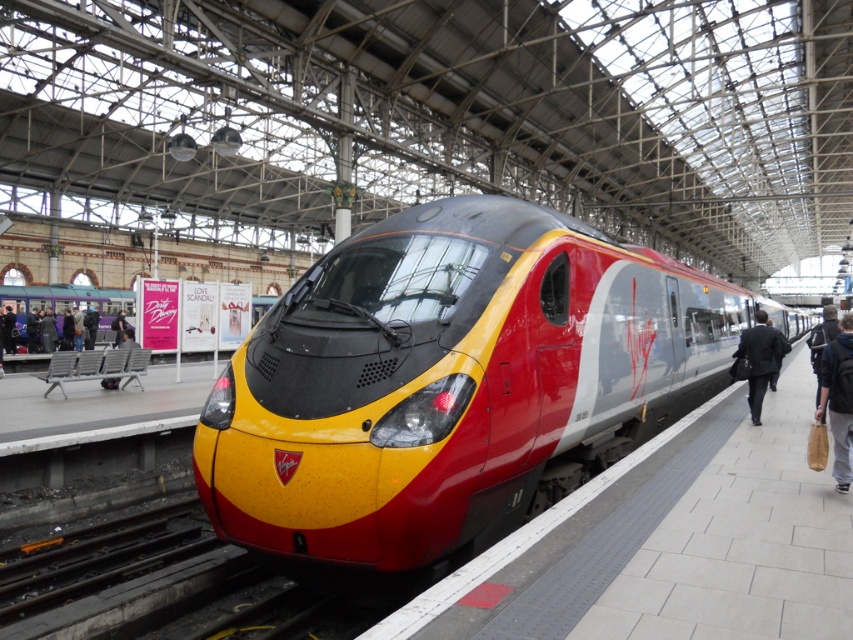
Does metallic red train at center have a larger size compared to dark purple clothing at left?

Indeed, metallic red train at center has a larger size compared to dark purple clothing at left.

Can you confirm if metallic red train at center is positioned below dark purple clothing at left?

Correct, metallic red train at center is located below dark purple clothing at left.

Does point (546, 452) come closer to viewer compared to point (55, 312)?

Yes.

Image resolution: width=853 pixels, height=640 pixels. I want to click on metallic red train at center, so click(450, 380).

Can you confirm if metallic red train at center is smaller than dark suit at right?

No, metallic red train at center is not smaller than dark suit at right.

This screenshot has width=853, height=640. What do you see at coordinates (450, 380) in the screenshot? I see `metallic red train at center` at bounding box center [450, 380].

What are the coordinates of `metallic red train at center` in the screenshot? It's located at (450, 380).

Can you confirm if dark purple clothing at left is bigger than dark suit at right?

Indeed, dark purple clothing at left has a larger size compared to dark suit at right.

Is dark purple clothing at left shorter than dark suit at right?

In fact, dark purple clothing at left may be taller than dark suit at right.

Locate an element on the screen. dark purple clothing at left is located at coordinates (73, 314).